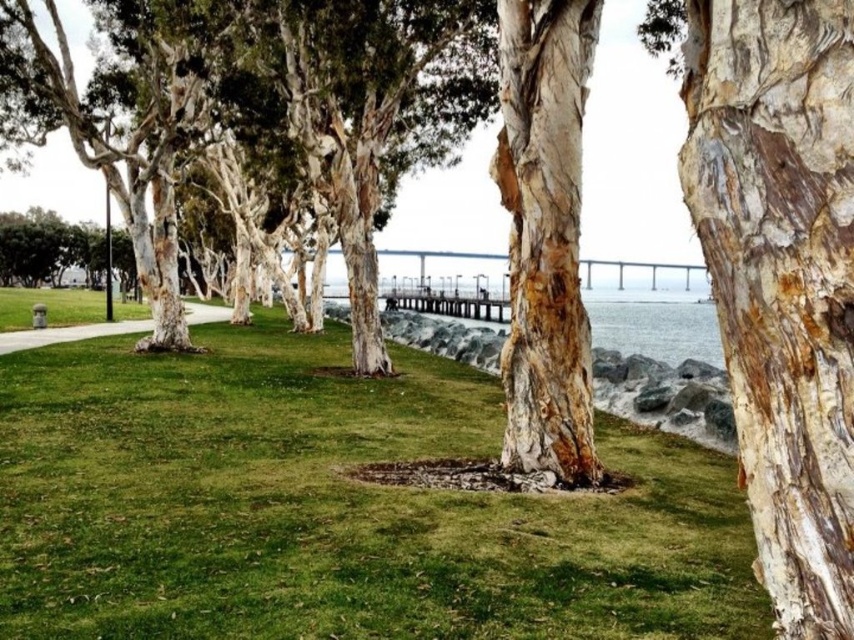
You are standing on the paved pathway and want to take a photo of the green bark tree at center. To get a clear view of the tree without any obstruction, should you move towards the green grass at center or away from it?

You should move away from the green grass at center because it is in front of the green bark tree at center and would block the view. Moving away would allow you to see the tree more clearly by getting around the obstruction.

You are standing at the lamppost near the edge of the path in the park. You want to walk to a specific point in the scene. Which of the two points, point (57, 625) or point (92, 266), is closer to your current position?

Point (57, 625) is closer to the camera than point (92, 266), so it is closer to your current position at the lamppost.